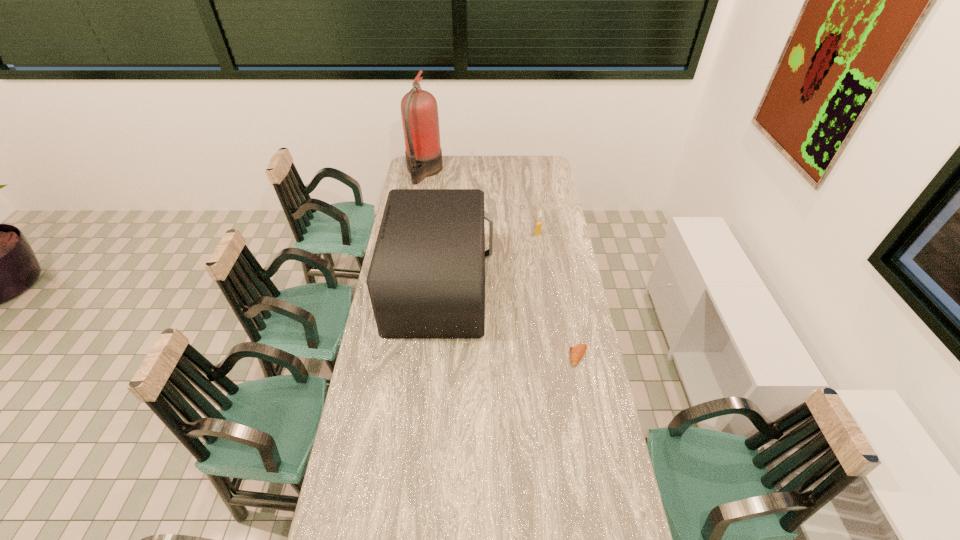
The height and width of the screenshot is (540, 960). In order to click on the farthest object in this screenshot , I will do `click(419, 110)`.

What are the coordinates of `the tallest object` in the screenshot? It's located at pyautogui.click(x=419, y=110).

Identify the location of microwave oven. (426, 280).

Where is `the third shortest object`? The height and width of the screenshot is (540, 960). the third shortest object is located at coordinates (426, 280).

Where is `the third nearest object`? Image resolution: width=960 pixels, height=540 pixels. the third nearest object is located at coordinates (538, 224).

At what (x,y) coordinates should I click in order to perform the action: click on the second object from right to left. Please return your answer as a coordinate pair (x, y). The image size is (960, 540). Looking at the image, I should click on (538, 224).

The image size is (960, 540). Identify the location of crescent roll. (577, 352).

Where is `the nearest object`? the nearest object is located at coordinates (577, 352).

This screenshot has width=960, height=540. In order to click on vacant space situated at the nozzle of the fire extinguisher in this screenshot , I will do `click(485, 172)`.

Where is `vacant space located 0.100m on the front-facing side of the third farthest object`? vacant space located 0.100m on the front-facing side of the third farthest object is located at coordinates (516, 287).